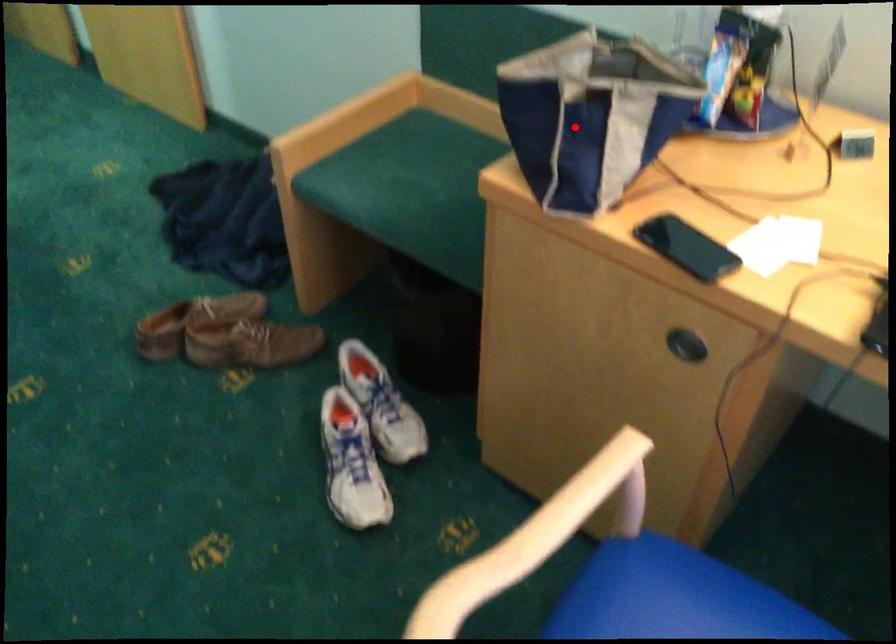
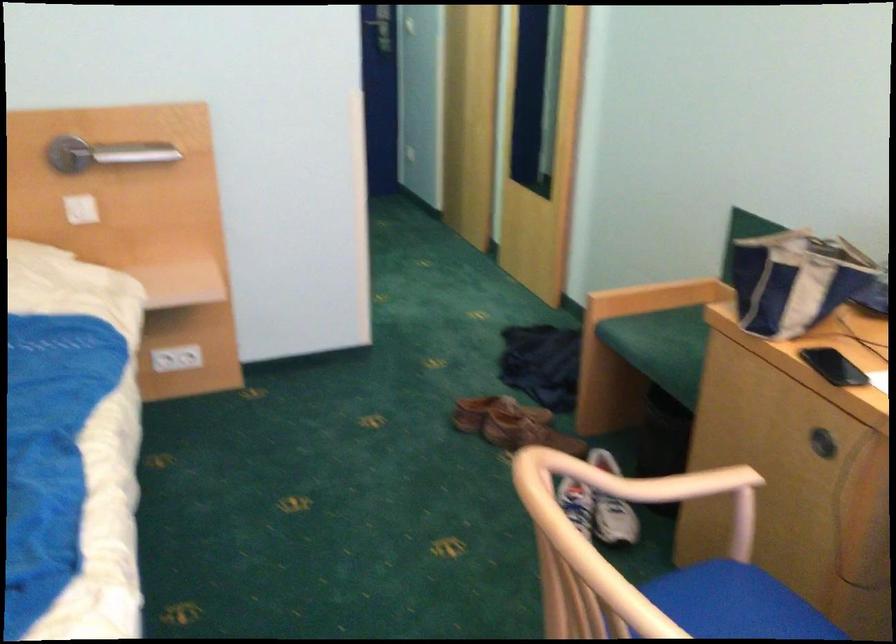
Find the pixel in the second image that matches the highlighted location in the first image.

(794, 279)